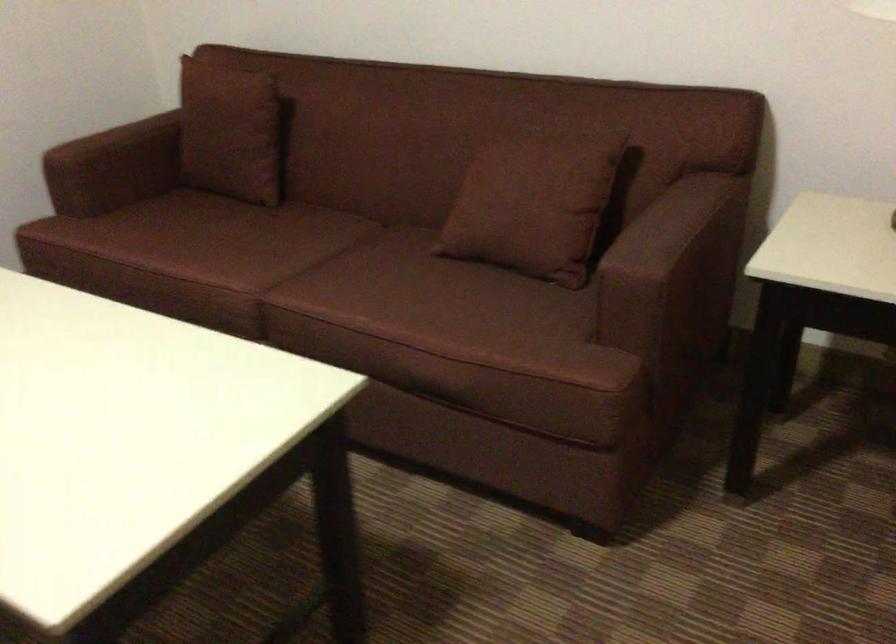
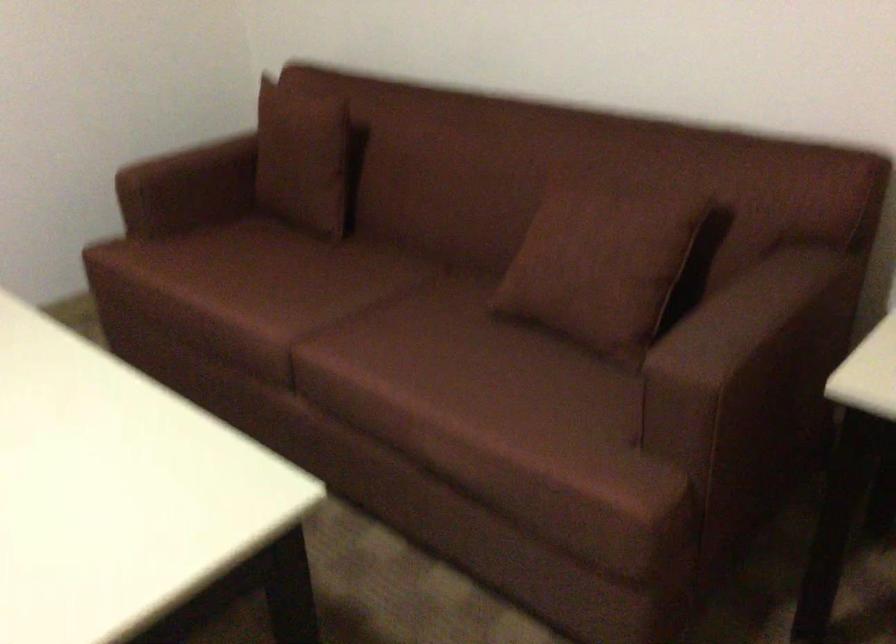
Where in the second image is the point corresponding to [235,243] from the first image?

(286, 283)